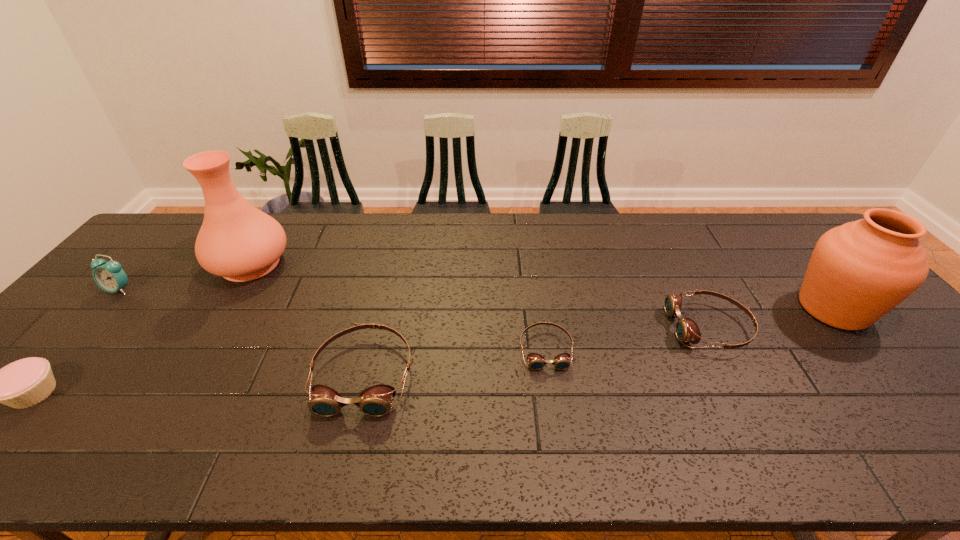
This screenshot has width=960, height=540. Identify the location of object present at the right edge. 858,272.

Locate an element on the screen. vacant space at the far edge of the desktop is located at coordinates (571, 236).

The height and width of the screenshot is (540, 960). Find the location of `free space at the near edge of the desktop`. free space at the near edge of the desktop is located at coordinates (252, 397).

In order to click on vacant space at the right edge of the desktop in this screenshot , I will do `click(895, 341)`.

The width and height of the screenshot is (960, 540). I want to click on free space at the far left corner of the desktop, so click(x=179, y=250).

The image size is (960, 540). In the image, there is a desktop. In order to click on vacant area at the near left corner in this screenshot , I will do `click(55, 395)`.

The image size is (960, 540). In order to click on vacant space at the far right corner in this screenshot , I will do `click(772, 240)`.

This screenshot has width=960, height=540. Identify the location of vacant area between the third tallest object and the second shortest goggles. (415, 308).

Locate an element on the screen. The height and width of the screenshot is (540, 960). free area in between the shortest goggles and the fifth object from right to left is located at coordinates (398, 306).

You are a GUI agent. You are given a task and a screenshot of the screen. Output one action in this format:
    pyautogui.click(x=<x>, y=<y>)
    Task: Click on the free space that is in between the second tallest goggles and the shortest object
    
    Given the screenshot: What is the action you would take?
    pyautogui.click(x=628, y=338)